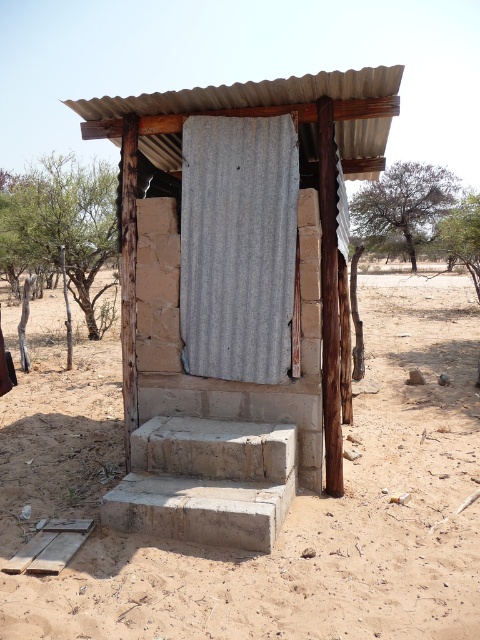
You are a traveler in a desert and need to enter the gray corrugated metal door at center of the corrugated metal hut at center. Considering the size of the door, will you be able to pass through it comfortably?

The corrugated metal hut at center is larger than the gray corrugated metal door at center. However, the door size is standard for human entry, so you can pass through it comfortably.

You are planning to build a small garden in the dull brown dirt at center near the gray corrugated metal door at center. Given the size of the door, will you have enough space to plant a 3x3 meter garden bed?

The dull brown dirt at center is bigger than the gray corrugated metal door at center. Since the garden bed is 3x3 meters, and the dirt area is larger than the door, there should be sufficient space to plant the garden bed.